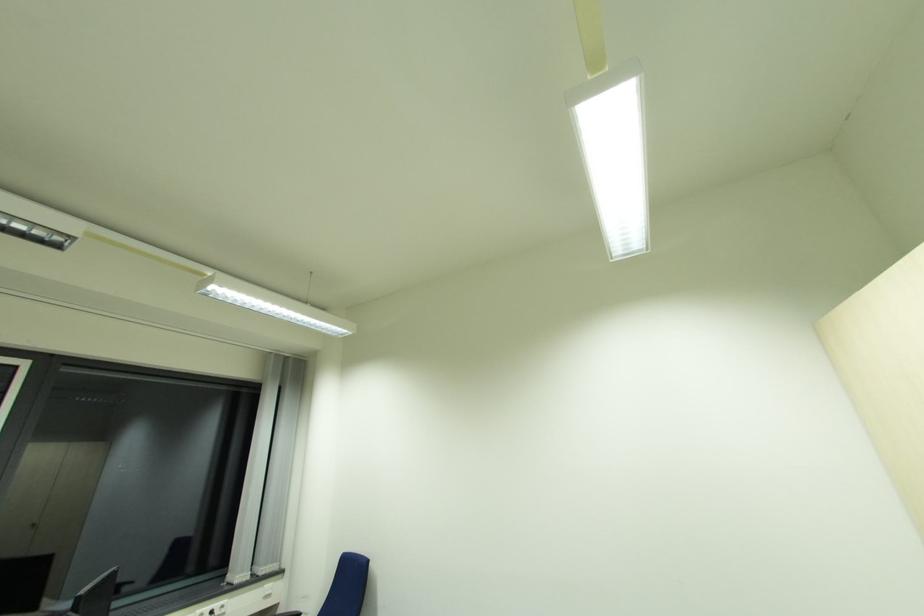
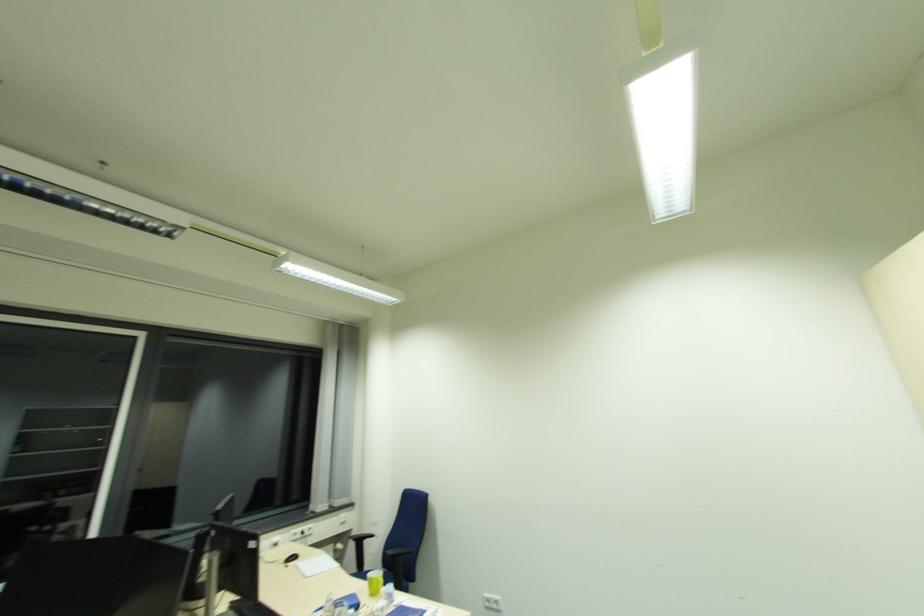
Which direction would the cameraman need to move to produce the second image?

The movement direction of the cameraman is left, backward.